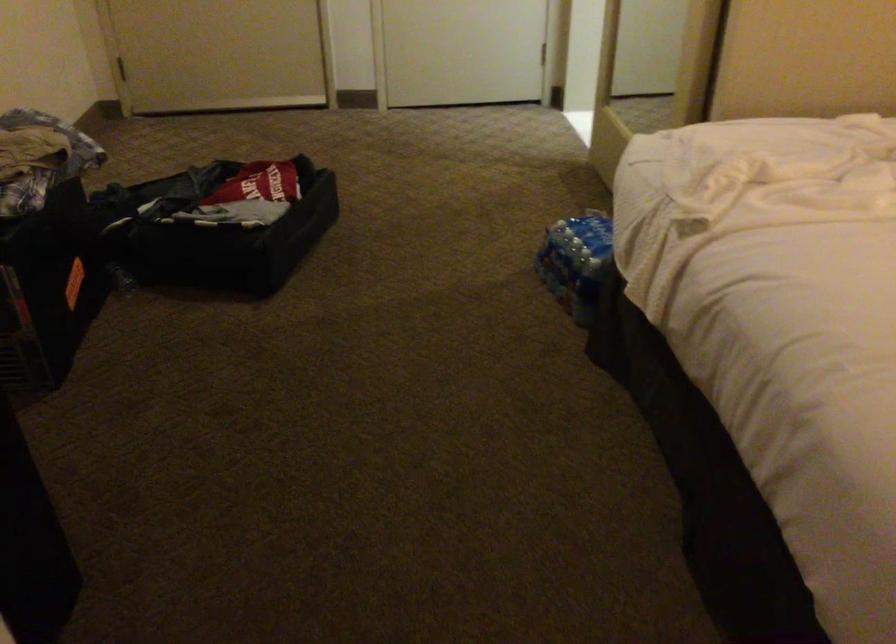
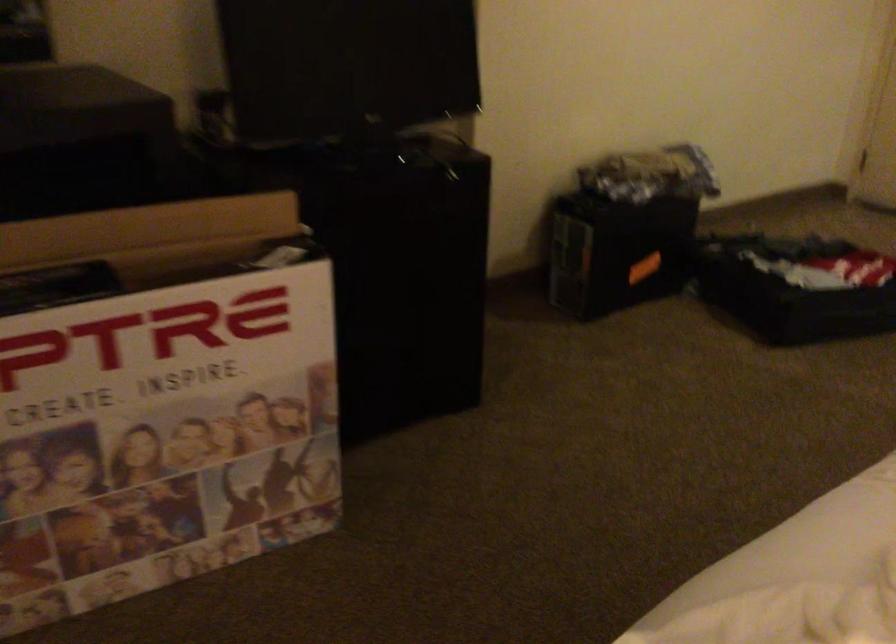
The point at (263, 237) is marked in the first image. Where is the corresponding point in the second image?

(794, 287)